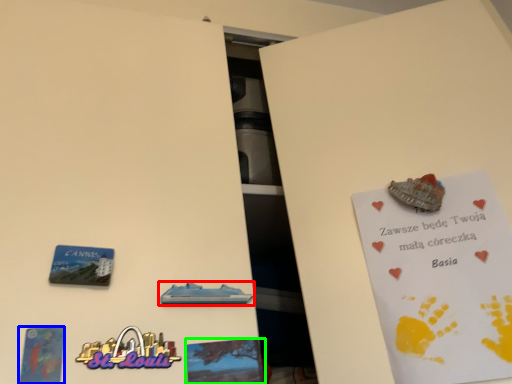
Question: Which object is the closest to the vehicle (highlighted by a red box)? Choose among these: postcard (highlighted by a blue box) or flyer (highlighted by a green box).

Choices:
 (A) postcard
 (B) flyer

Answer: (B)